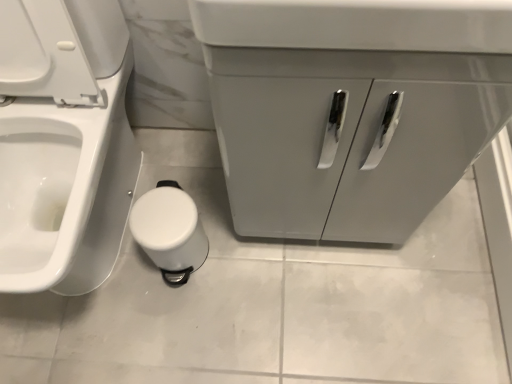
Question: Considering the positions of point (60, 254) and point (321, 79), is point (60, 254) closer or farther from the camera than point (321, 79)?

Choices:
 (A) closer
 (B) farther

Answer: (B)

Question: Is white glossy toilet at lower left bigger or smaller than matte gray cabinet at center?

Choices:
 (A) small
 (B) big

Answer: (B)

Question: Which object is the farthest from the white glossy toilet at lower left?

Choices:
 (A) matte gray cabinet at center
 (B) white plastic toilet paper at lower center

Answer: (A)

Question: Estimate the real-world distances between objects in this image. Which object is farther from the white plastic toilet paper at lower center?

Choices:
 (A) matte gray cabinet at center
 (B) white glossy toilet at lower left

Answer: (A)